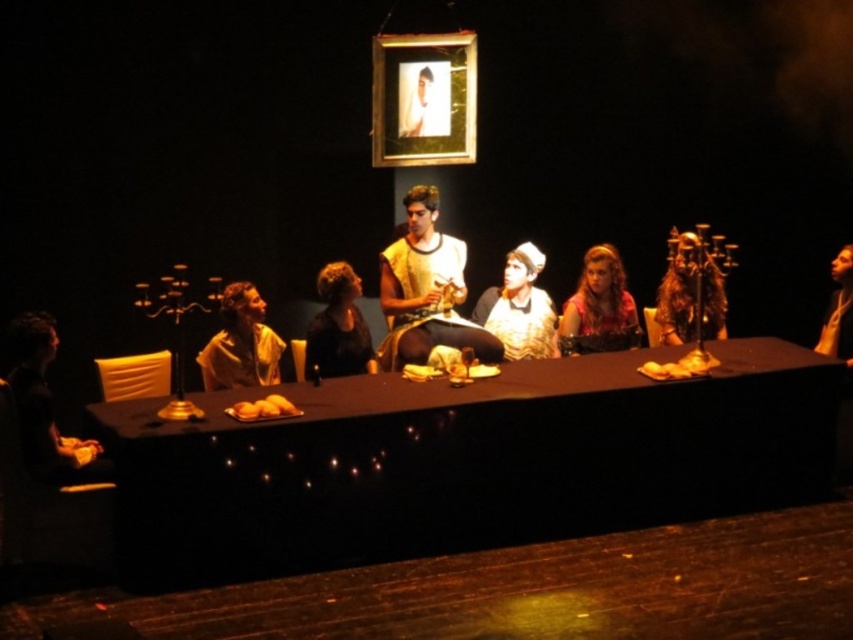
Is gold-framed photo at upper center taller than dark matte shirt at center?

Yes.

Does gold-framed photo at upper center appear on the left side of dark matte shirt at center?

No, gold-framed photo at upper center is not to the left of dark matte shirt at center.

Between point (376, 40) and point (309, 332), which one is positioned behind?

Point (376, 40)

What are the coordinates of `gold-framed photo at upper center` in the screenshot? It's located at (422, 99).

Can you confirm if gold fabric robe at center is shorter than matte yellow shirt at center?

No.

Who is more forward, (419, 221) or (253, 307)?

Point (253, 307) is in front.

You are a GUI agent. You are given a task and a screenshot of the screen. Output one action in this format:
    pyautogui.click(x=<x>, y=<y>)
    Task: Click on the gold fabric robe at center
    The width and height of the screenshot is (853, 640).
    Given the screenshot: What is the action you would take?
    pyautogui.click(x=426, y=291)

In the scene shown: Does black matte table at center appear on the left side of matte pink blouse at center?

Correct, you'll find black matte table at center to the left of matte pink blouse at center.

Which of these two, black matte table at center or matte pink blouse at center, stands taller?

black matte table at center is taller.

Does point (103, 426) come closer to viewer compared to point (635, 310)?

Yes.

The height and width of the screenshot is (640, 853). I want to click on black matte table at center, so click(463, 461).